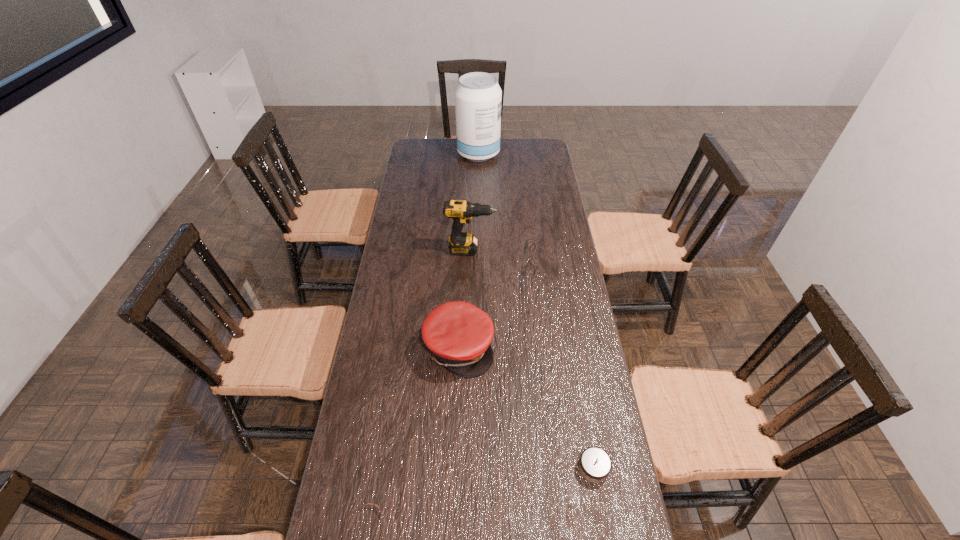
Locate an element on the screen. Image resolution: width=960 pixels, height=540 pixels. alcohol is located at coordinates (478, 97).

Image resolution: width=960 pixels, height=540 pixels. What are the coordinates of `the farthest object` in the screenshot? It's located at (478, 97).

Identify the location of the fourth nearest object. Image resolution: width=960 pixels, height=540 pixels. click(x=461, y=243).

Find the location of a particular element. The width and height of the screenshot is (960, 540). the fourth shortest object is located at coordinates (461, 243).

You are a GUI agent. You are given a task and a screenshot of the screen. Output one action in this format:
    pyautogui.click(x=<x>, y=<y>)
    Task: Click on the cap
    
    Given the screenshot: What is the action you would take?
    pyautogui.click(x=459, y=334)

Where is `the third nearest object`? the third nearest object is located at coordinates pos(459,334).

Where is `the second shortest object`? the second shortest object is located at coordinates (595, 464).

Identify the location of chocolate cake. The height and width of the screenshot is (540, 960). (595, 464).

Find the location of a particular element. The image size is (960, 540). free spot located 0.160m on the left of the alcohol is located at coordinates (426, 154).

In order to click on free spot located at the tip of the drill in this screenshot , I will do `click(551, 250)`.